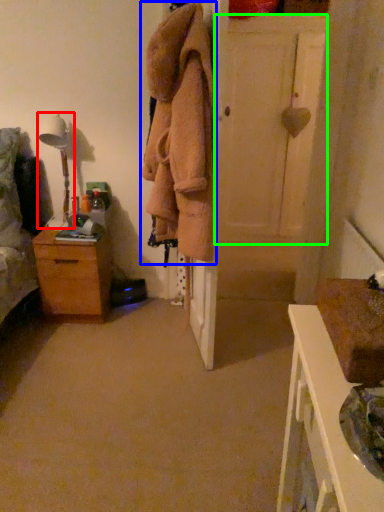
Question: Which is nearer to the table lamp (highlighted by a red box)? clothing (highlighted by a blue box) or door (highlighted by a green box).

Choices:
 (A) clothing
 (B) door

Answer: (A)